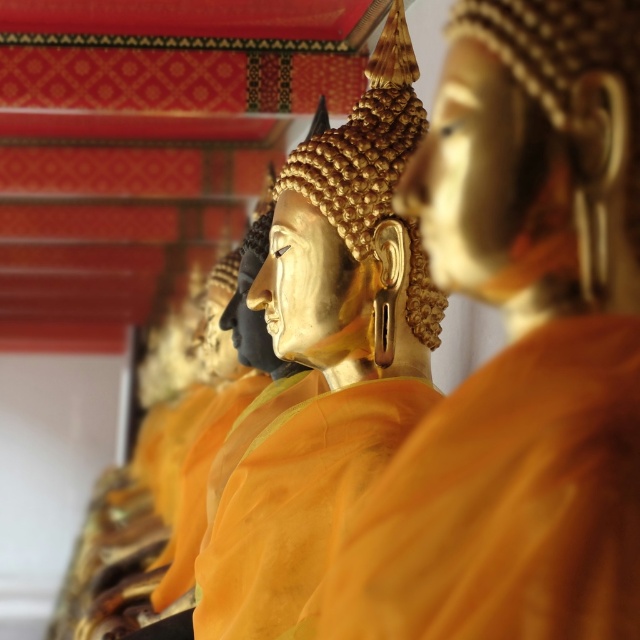
You are standing in front of a row of golden Buddha statues. You notice a gold polished statue at center. Can you determine its exact position relative to the other statues?

The gold polished statue at center is located at point coordinates of (326,353), so it is positioned slightly to the right and above the central point of the entire row of statues.

You are standing in front of a row of golden Buddha statues. You notice a point marked at coordinates (518, 346). Which statue is this point indicating?

The point at coordinates (518, 346) indicates the gold shiny monk at center.

You are a visitor at a temple and notice the gold polished statue at center and the matte orange fabric at center. Which object is placed higher in the scene?

The gold polished statue at center is positioned over matte orange fabric at center, so it is placed higher.